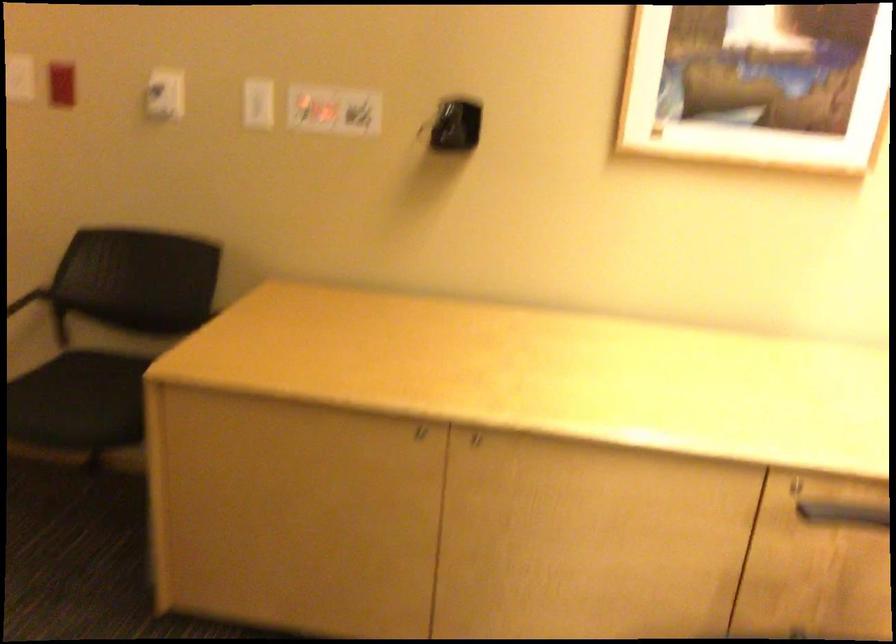
What do you see at coordinates (828, 507) in the screenshot? I see `the metal drawer handle` at bounding box center [828, 507].